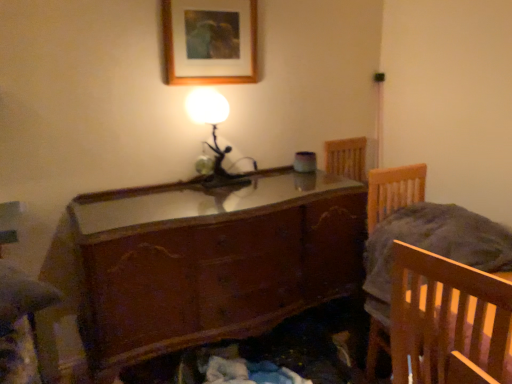
Question: Is wooden glossy chest of drawers at center inside or outside of wooden bed frame at right?

Choices:
 (A) inside
 (B) outside

Answer: (B)

Question: Would you say wooden glossy chest of drawers at center is to the left or to the right of wooden bed frame at right in the picture?

Choices:
 (A) left
 (B) right

Answer: (A)

Question: Which is nearer to the wooden glossy chest of drawers at center?

Choices:
 (A) wooden bed frame at right
 (B) wooden picture frame at upper center
 (C) matte glass table lamp at upper center

Answer: (C)

Question: Considering the real-world distances, which object is farthest from the wooden picture frame at upper center?

Choices:
 (A) matte glass table lamp at upper center
 (B) wooden bed frame at right
 (C) wooden glossy chest of drawers at center

Answer: (B)